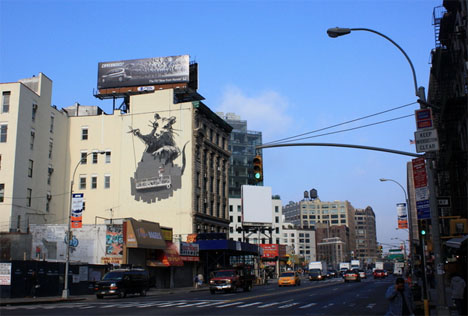
Find the location of a particular element. The width and height of the screenshot is (468, 316). right front leg is located at coordinates pos(142,137).